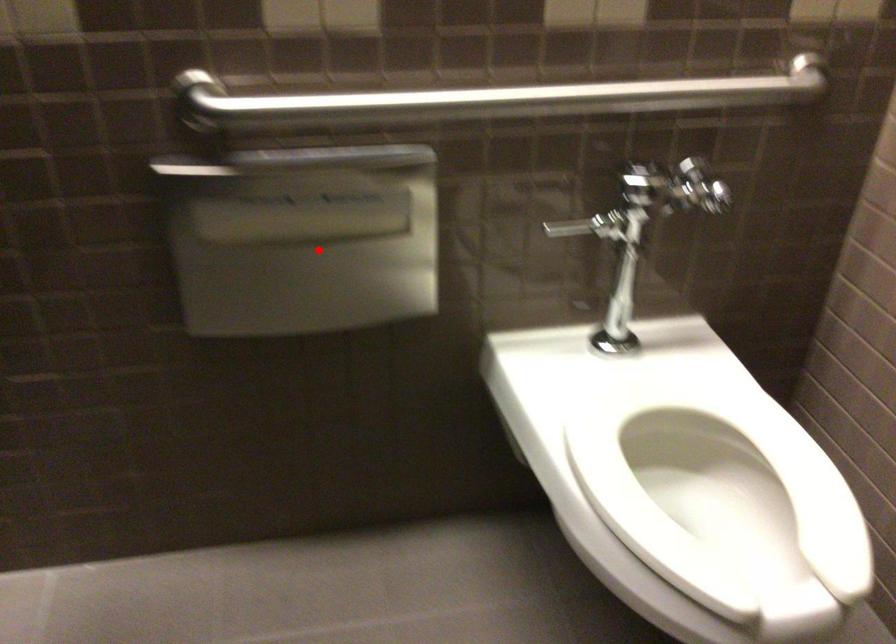
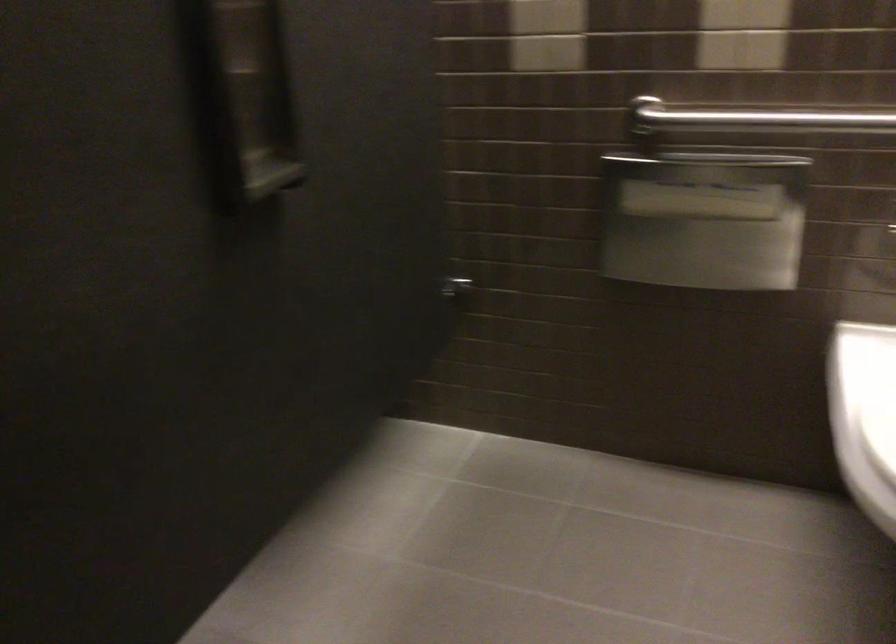
Question: I am providing you with two images of the same scene from different viewpoints. In image1, a red point is highlighted. Considering the same 3D point in image2, which of the following is correct?

Choices:
 (A) It is closer
 (B) It is farther

Answer: (B)